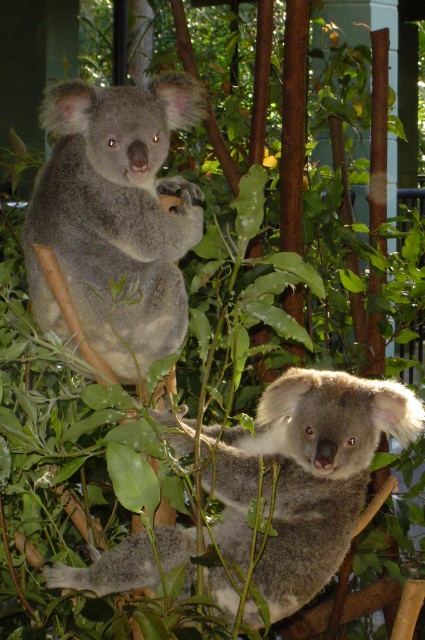
Question: Among these points, which one is nearest to the camera?

Choices:
 (A) (300, 577)
 (B) (172, 243)

Answer: (A)

Question: Does gray furry koala at upper left have a lesser width compared to fuzzy gray koala at center?

Choices:
 (A) no
 (B) yes

Answer: (B)

Question: Does gray furry koala at upper left appear on the left side of fuzzy gray koala at center?

Choices:
 (A) no
 (B) yes

Answer: (B)

Question: Is the position of gray furry koala at upper left more distant than that of fuzzy gray koala at center?

Choices:
 (A) yes
 (B) no

Answer: (A)